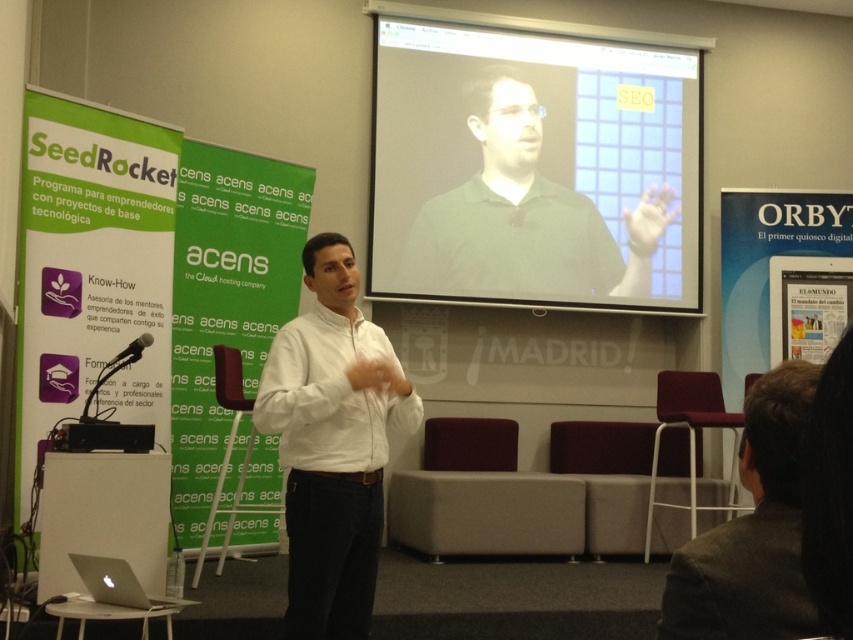
Question: Is dark brown hair at lower right to the left of silver metallic laptop at lower left from the viewer's perspective?

Choices:
 (A) yes
 (B) no

Answer: (B)

Question: Does matte black projector screen at upper center have a lesser width compared to white matte shirt at center?

Choices:
 (A) yes
 (B) no

Answer: (B)

Question: Which point is closer to the camera taking this photo?

Choices:
 (A) (376, 64)
 (B) (782, 413)
 (C) (352, 515)
 (D) (73, 561)

Answer: (B)

Question: Among these objects, which one is nearest to the camera?

Choices:
 (A) matte black projector screen at upper center
 (B) dark brown hair at lower right
 (C) white matte shirt at center
 (D) silver metallic laptop at lower left

Answer: (B)

Question: Estimate the real-world distances between objects in this image. Which object is closer to the white matte shirt at center?

Choices:
 (A) matte black projector screen at upper center
 (B) silver metallic laptop at lower left
 (C) dark brown hair at lower right

Answer: (B)

Question: Does matte black projector screen at upper center appear under white matte shirt at center?

Choices:
 (A) yes
 (B) no

Answer: (B)